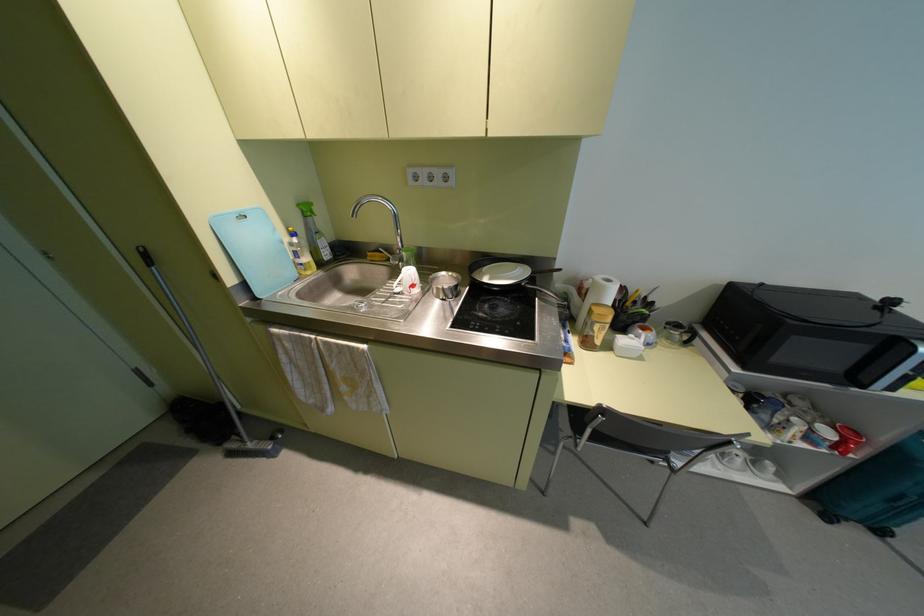
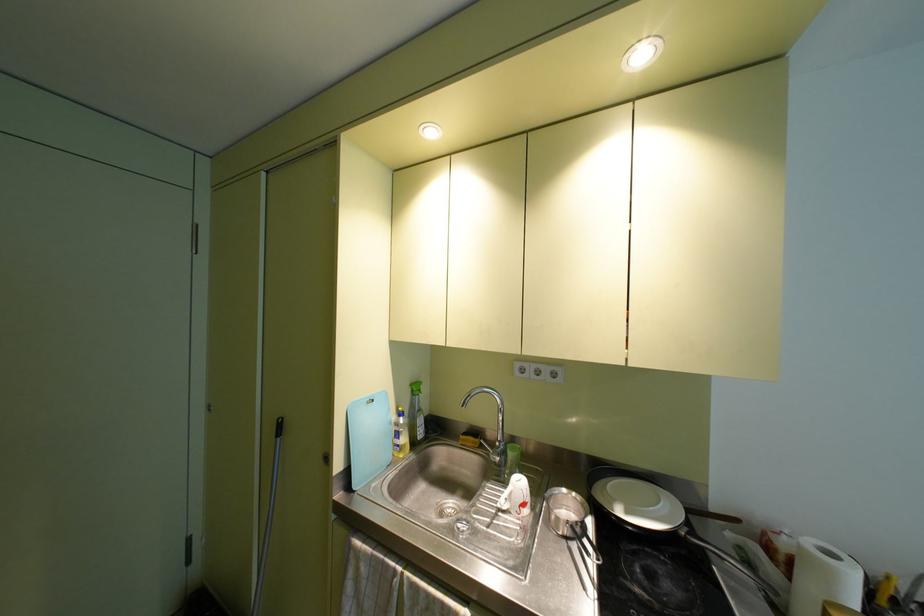
Question: How did the camera likely rotate?

Choices:
 (A) Left
 (B) Right
 (C) Up
 (D) Down

Answer: (C)